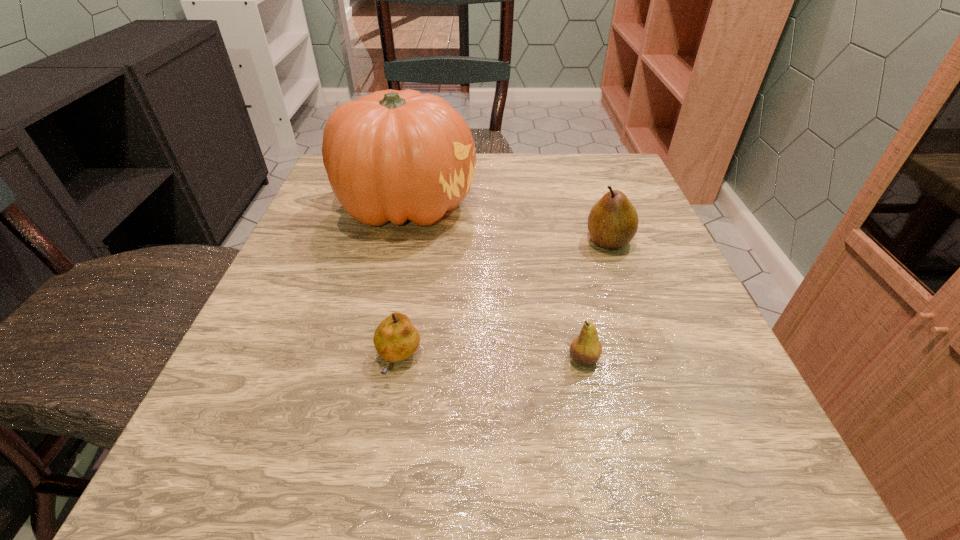
This screenshot has width=960, height=540. In order to click on free spot that satisfies the following two spatial constraints: 1. on the carved face of the shortest pear; 2. on the right side of the pumpkin in this screenshot , I will do `click(372, 360)`.

At what (x,y) coordinates should I click in order to perform the action: click on free location that satisfies the following two spatial constraints: 1. on the carved face of the tallest object; 2. on the right side of the third shortest object. Please return your answer as a coordinate pair (x, y). This screenshot has width=960, height=540. Looking at the image, I should click on (398, 241).

Locate an element on the screen. free location that satisfies the following two spatial constraints: 1. on the carved face of the pumpkin; 2. on the back side of the leftmost pear is located at coordinates (372, 360).

Locate an element on the screen. This screenshot has width=960, height=540. vacant space that satisfies the following two spatial constraints: 1. on the carved face of the second object from right to left; 2. on the right side of the tallest object is located at coordinates (372, 359).